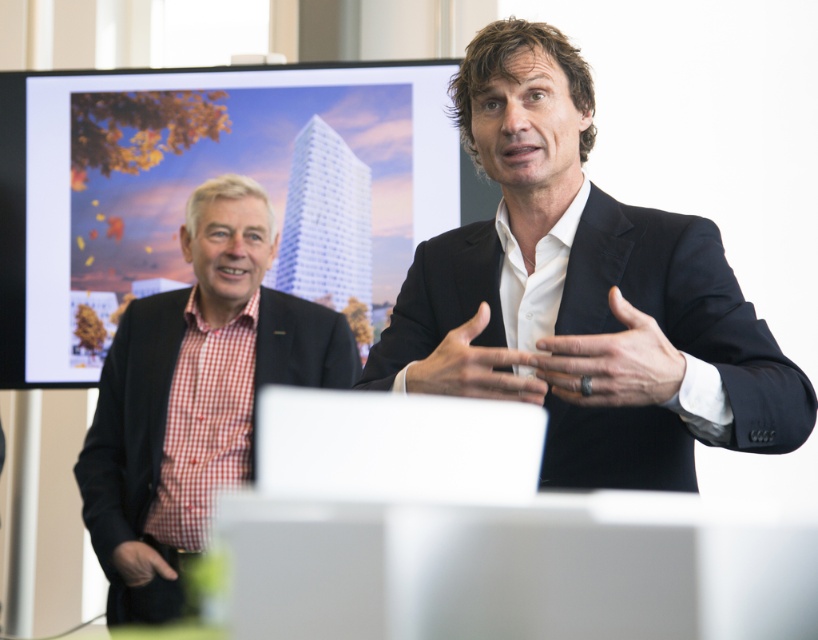
Question: Which point is farther from the camera taking this photo?

Choices:
 (A) (605, 326)
 (B) (470, 388)
 (C) (122, 470)

Answer: (C)

Question: Is red checkered shirt at left smaller than black matte hand at lower left?

Choices:
 (A) yes
 (B) no

Answer: (B)

Question: Is black leather hand at center further to the viewer compared to black matte hand at lower left?

Choices:
 (A) yes
 (B) no

Answer: (B)

Question: Does black leather hand at center appear over black matte hand at lower left?

Choices:
 (A) no
 (B) yes

Answer: (B)

Question: Among these objects, which one is farthest from the camera?

Choices:
 (A) matte black hand at center
 (B) red checkered shirt at left
 (C) black suit at center

Answer: (B)

Question: Which object is farther from the camera taking this photo?

Choices:
 (A) black matte hand at lower left
 (B) red checkered shirt at left

Answer: (B)